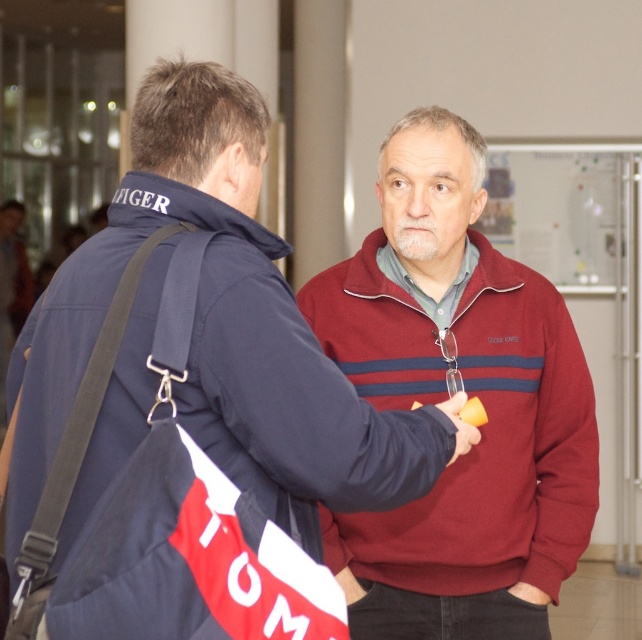
Question: Which of these objects is positioned closest to the burgundy fleece at center?

Choices:
 (A) maroon sweater at center
 (B) blue fabric bag at left

Answer: (A)

Question: Can you confirm if burgundy fleece at center is bigger than maroon sweater at center?

Choices:
 (A) yes
 (B) no

Answer: (B)

Question: Is burgundy fleece at center to the right of blue fabric bag at left from the viewer's perspective?

Choices:
 (A) yes
 (B) no

Answer: (A)

Question: Which of the following is the farthest from the observer?

Choices:
 (A) maroon sweater at center
 (B) burgundy fleece at center

Answer: (B)

Question: Does burgundy fleece at center lie in front of maroon sweater at center?

Choices:
 (A) yes
 (B) no

Answer: (B)

Question: Which of the following is the closest to the observer?

Choices:
 (A) maroon sweater at center
 (B) blue fabric bag at left
 (C) burgundy fleece at center

Answer: (A)